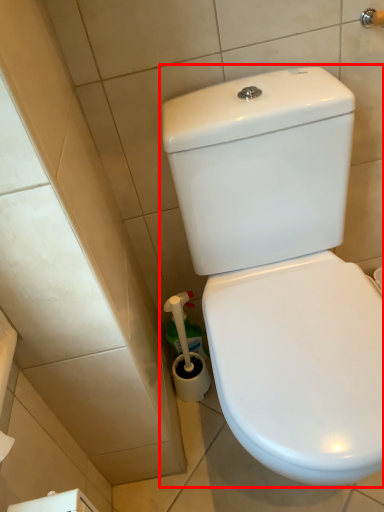
Question: In this image, where is toilet (annotated by the red box) located relative to brush?

Choices:
 (A) left
 (B) right

Answer: (B)